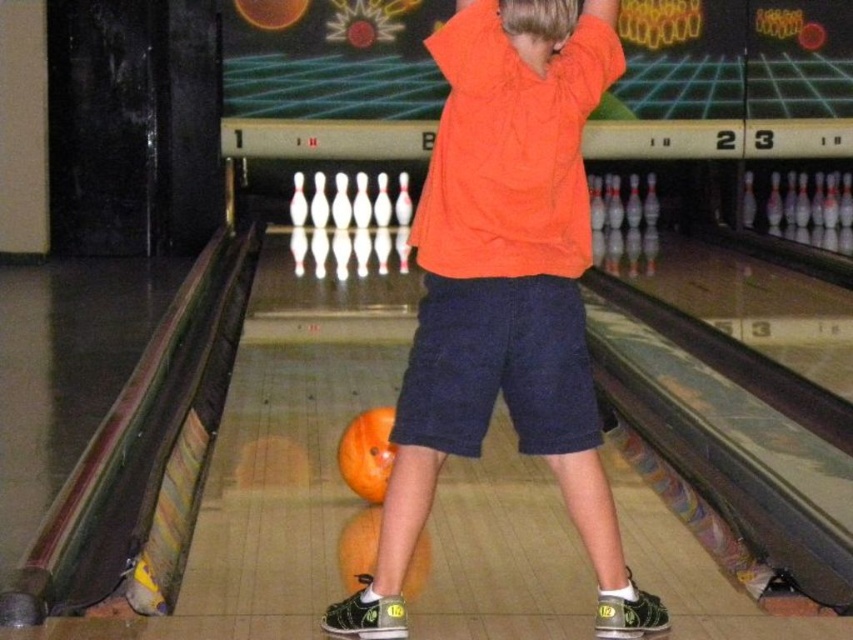
You are a bowling ball inspector checking the position of the orange cotton shirt at center and the orange matte bowling ball at lower center. Which object is positioned higher in the image?

The orange cotton shirt at center is above the orange matte bowling ball at lower center, so the orange cotton shirt at center is positioned higher in the image.

You are a bowling ball inspector checking the position of the orange cotton shirt at center and the orange matte bowling ball at lower center. Which object is closer to the bowler?

The orange cotton shirt at center is closer to the bowler because it is in front of the orange matte bowling ball at lower center.

You are a bowling coach observing a student practicing. You see the orange matte bowling ball at center and the orange matte bowling ball at lower center. Which one is closer to the pins at the end of the lane?

The orange matte bowling ball at lower center is closer to the pins at the end of the lane because it is positioned lower on the lane, which is typically where the pins are located.